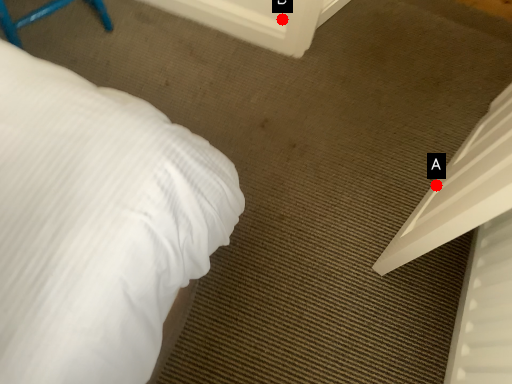
Question: Two points are circled on the image, labeled by A and B beside each circle. Which point is farther to the camera?

Choices:
 (A) A is further
 (B) B is further

Answer: (B)